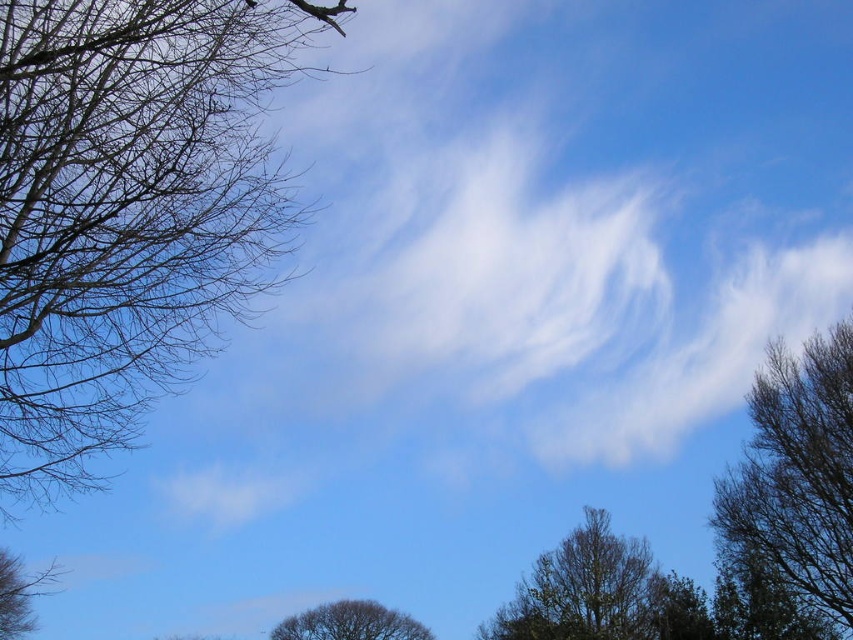
Can you confirm if brown textured tree at right is positioned below brown textured tree at lower center?

Actually, brown textured tree at right is above brown textured tree at lower center.

Does brown textured tree at right have a smaller size compared to brown textured tree at lower center?

Indeed, brown textured tree at right has a smaller size compared to brown textured tree at lower center.

Between point (801, 483) and point (369, 625), which one is positioned behind?

Point (369, 625)

You are a GUI agent. You are given a task and a screenshot of the screen. Output one action in this format:
    pyautogui.click(x=<x>, y=<y>)
    Task: Click on the brown textured tree at right
    Image resolution: width=853 pixels, height=640 pixels.
    Given the screenshot: What is the action you would take?
    pyautogui.click(x=795, y=483)

Is brown/dry branches at upper left thinner than brown leafless branch at lower left?

No.

Between brown/dry branches at upper left and brown leafless branch at lower left, which one has less height?

brown leafless branch at lower left is shorter.

Does point (97, 86) come behind point (19, 566)?

No, (97, 86) is in front of (19, 566).

Where is `brown/dry branches at upper left`? This screenshot has height=640, width=853. brown/dry branches at upper left is located at coordinates (126, 209).

Is brown textured tree at right smaller than green leafy tree at lower center?

Yes, brown textured tree at right is smaller than green leafy tree at lower center.

Is brown textured tree at right to the right of green leafy tree at lower center from the viewer's perspective?

Correct, you'll find brown textured tree at right to the right of green leafy tree at lower center.

Is point (834, 396) positioned in front of point (525, 636)?

Yes, it is.

Where is `brown textured tree at right`? Image resolution: width=853 pixels, height=640 pixels. brown textured tree at right is located at coordinates (795, 483).